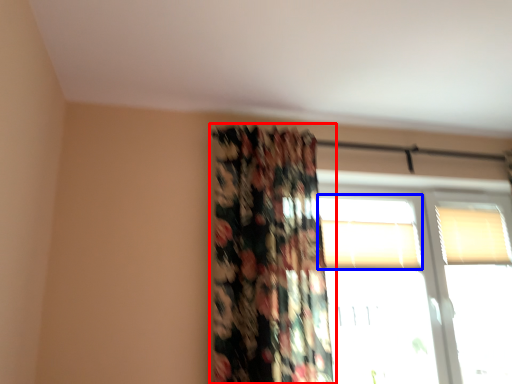
Question: Among these objects, which one is nearest to the camera, curtain (highlighted by a red box) or window (highlighted by a blue box)?

Choices:
 (A) curtain
 (B) window

Answer: (A)